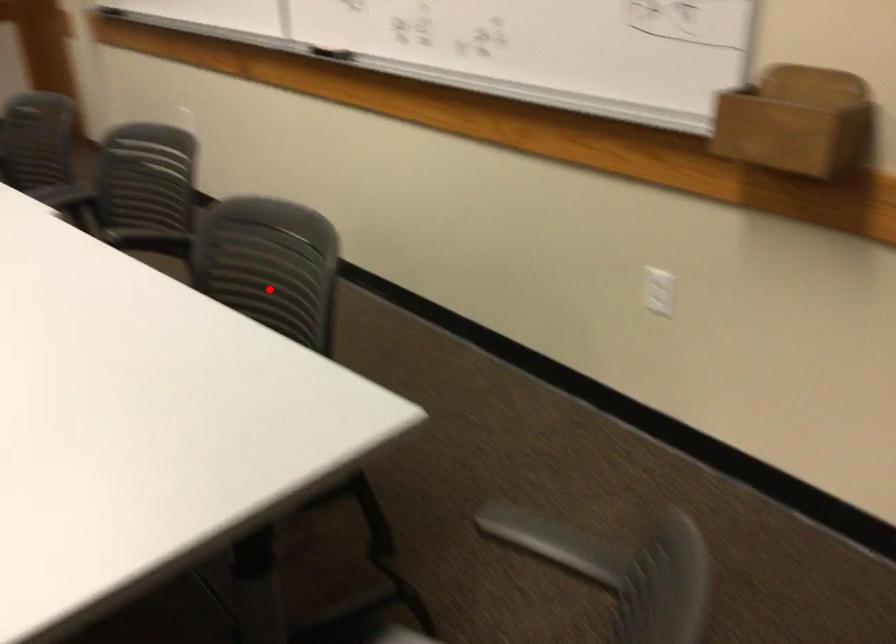
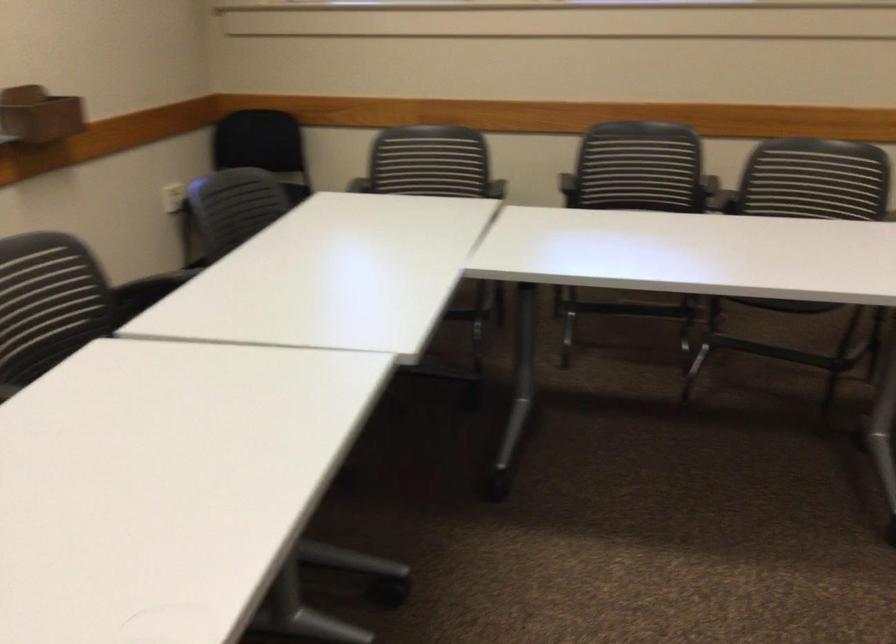
Question: I am providing you with two images of the same scene from different viewpoints. A red point is marked on the first image. Can you still see the location of the red point in image 2?

Choices:
 (A) Yes
 (B) No

Answer: (B)